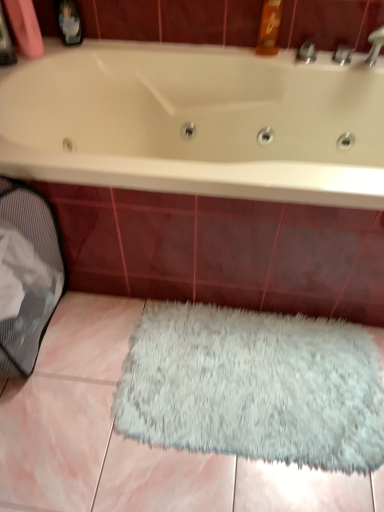
Question: From a real-world perspective, is white glossy bathtub at upper center positioned over gray mesh laundry basket at lower left based on gravity?

Choices:
 (A) no
 (B) yes

Answer: (B)

Question: Can you confirm if white glossy bathtub at upper center is positioned to the left of gray mesh laundry basket at lower left?

Choices:
 (A) yes
 (B) no

Answer: (B)

Question: Considering the relative sizes of white glossy bathtub at upper center and gray mesh laundry basket at lower left in the image provided, is white glossy bathtub at upper center thinner than gray mesh laundry basket at lower left?

Choices:
 (A) yes
 (B) no

Answer: (B)

Question: Could you tell me if white glossy bathtub at upper center is facing gray mesh laundry basket at lower left?

Choices:
 (A) yes
 (B) no

Answer: (A)

Question: Is white glossy bathtub at upper center positioned behind gray mesh laundry basket at lower left?

Choices:
 (A) yes
 (B) no

Answer: (A)

Question: Choose the correct answer: Is white fluffy rug at lower center inside white glossy bathtub at upper center or outside it?

Choices:
 (A) outside
 (B) inside

Answer: (A)

Question: Is point (183, 394) positioned closer to the camera than point (357, 144)?

Choices:
 (A) farther
 (B) closer

Answer: (B)

Question: From the image's perspective, relative to white glossy bathtub at upper center, is white fluffy rug at lower center above or below?

Choices:
 (A) above
 (B) below

Answer: (B)

Question: Is white fluffy rug at lower center in front of or behind white glossy bathtub at upper center in the image?

Choices:
 (A) behind
 (B) front

Answer: (A)

Question: From the image's perspective, is gray mesh laundry basket at lower left above or below white fluffy rug at lower center?

Choices:
 (A) above
 (B) below

Answer: (A)

Question: Does point coord(0,224) appear closer or farther from the camera than point coord(289,420)?

Choices:
 (A) farther
 (B) closer

Answer: (B)

Question: Relative to white fluffy rug at lower center, is gray mesh laundry basket at lower left in front or behind?

Choices:
 (A) front
 (B) behind

Answer: (A)

Question: From a real-world perspective, is gray mesh laundry basket at lower left physically located above or below white fluffy rug at lower center?

Choices:
 (A) above
 (B) below

Answer: (A)

Question: Is point (364, 83) positioned closer to the camera than point (38, 350)?

Choices:
 (A) closer
 (B) farther

Answer: (B)

Question: Is white glossy bathtub at upper center inside or outside of gray mesh laundry basket at lower left?

Choices:
 (A) inside
 (B) outside

Answer: (B)